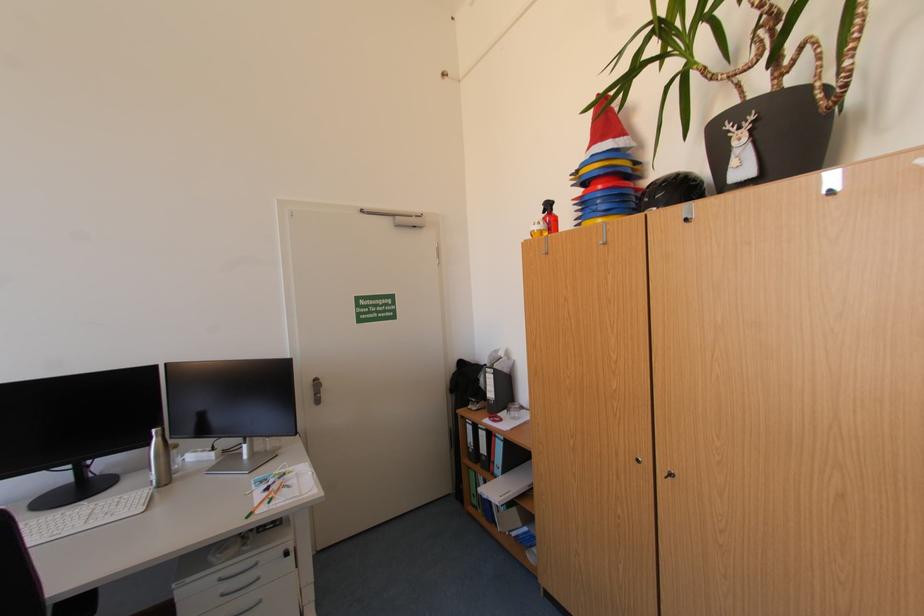
Which object does [232,406] point to?

This point indicates the black ring binder.